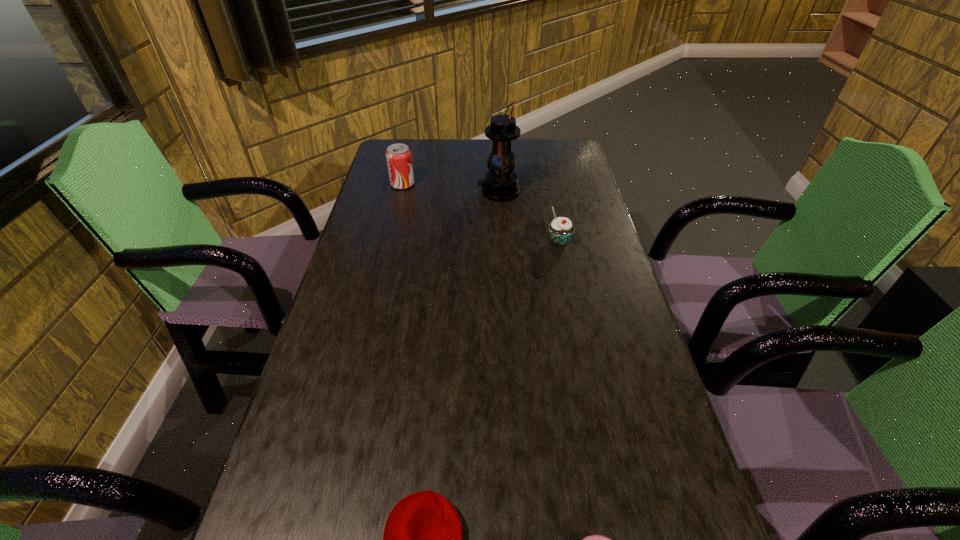
This screenshot has width=960, height=540. I want to click on blank space that satisfies the following two spatial constraints: 1. above the third object from right to left, indicating its light source; 2. on the left side of the third tallest object, so click(502, 241).

You are a GUI agent. You are given a task and a screenshot of the screen. Output one action in this format:
    pyautogui.click(x=<x>, y=<y>)
    Task: Click on the vacant area that satisfies the following two spatial constraints: 1. on the front side of the second tallest object; 2. on the right side of the cupcake
    
    Given the screenshot: What is the action you would take?
    pyautogui.click(x=389, y=241)